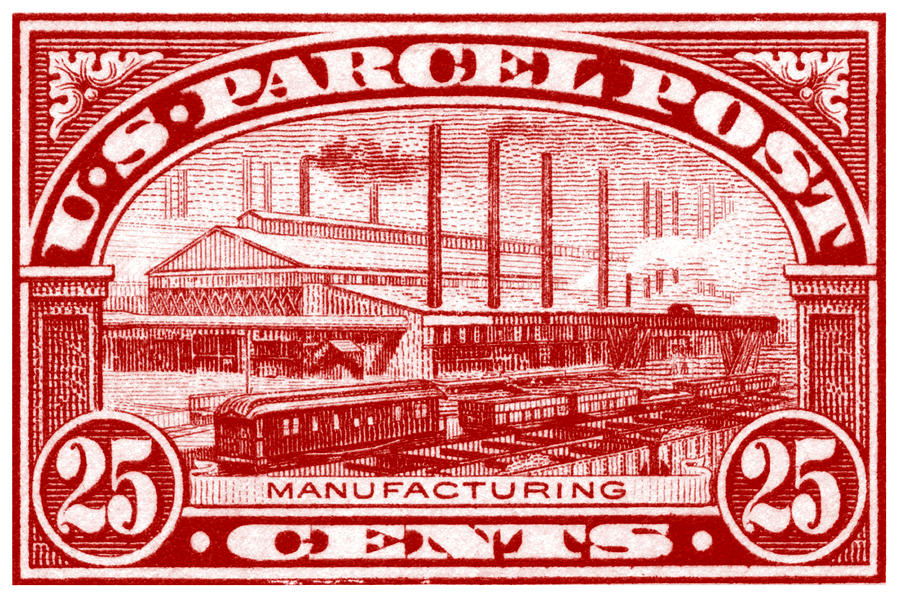
Image resolution: width=900 pixels, height=597 pixels. What are the coordinates of `red curved arch` in the screenshot? It's located at click(183, 133).